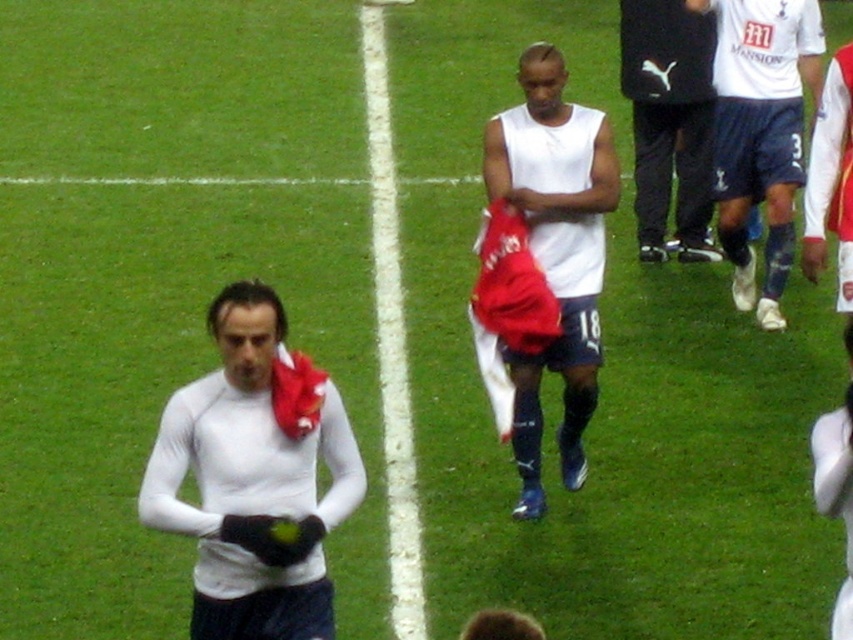
Question: Which object is closer to the camera taking this photo?

Choices:
 (A) white matte shirt at center
 (B) white smooth line at center
 (C) white jersey at center

Answer: (A)

Question: Considering the real-world distances, which object is farthest from the black puma tracksuit at center?

Choices:
 (A) white matte shirt at center
 (B) white jersey at center
 (C) white smooth line at center
 (D) white matte jersey at center

Answer: (A)

Question: Which object is positioned farthest from the black puma tracksuit at center?

Choices:
 (A) white jersey at center
 (B) white matte shirt at center

Answer: (B)

Question: Is white jersey at center closer to the viewer compared to black puma tracksuit at center?

Choices:
 (A) no
 (B) yes

Answer: (B)

Question: Is white matte shirt at center bigger than white smooth line at center?

Choices:
 (A) no
 (B) yes

Answer: (A)

Question: Is white matte shirt at center to the left of white smooth line at center from the viewer's perspective?

Choices:
 (A) yes
 (B) no

Answer: (A)